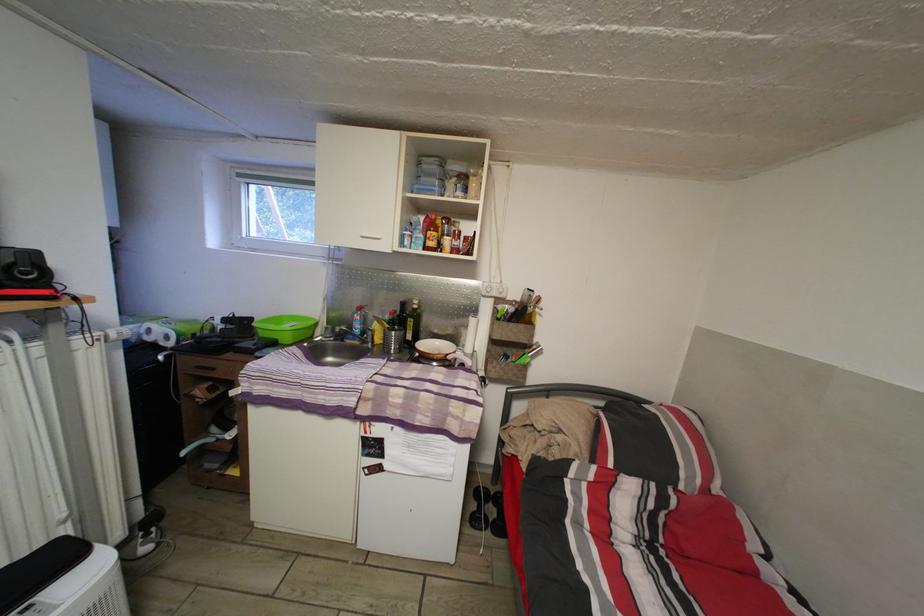
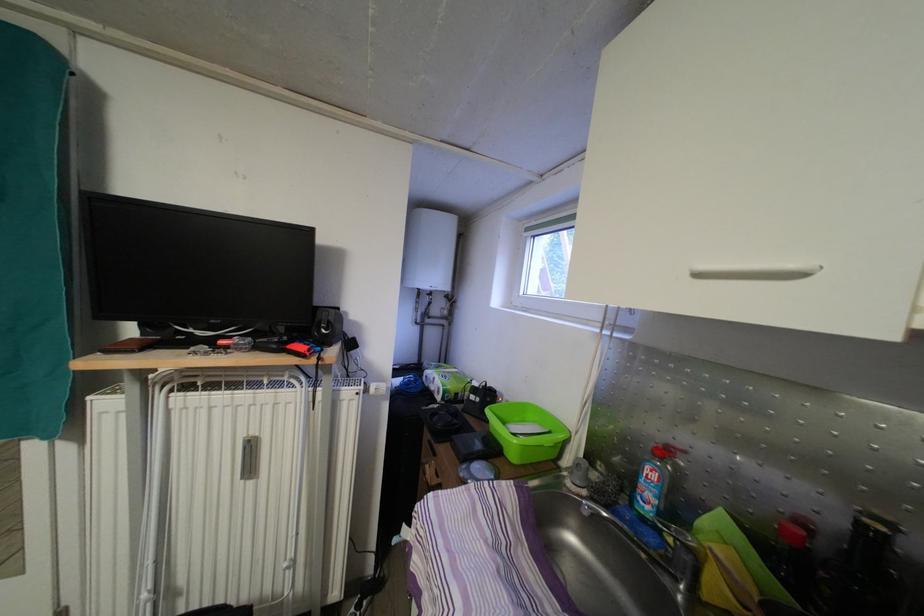
In the second image, find the point that corresponds to point 197,334 in the first image.

(460, 394)